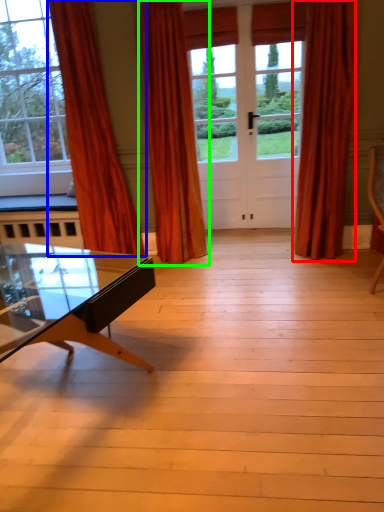
Question: Which object is the farthest from curtain (highlighted by a red box)? Choose among these: curtain (highlighted by a blue box) or curtain (highlighted by a green box).

Choices:
 (A) curtain
 (B) curtain

Answer: (A)